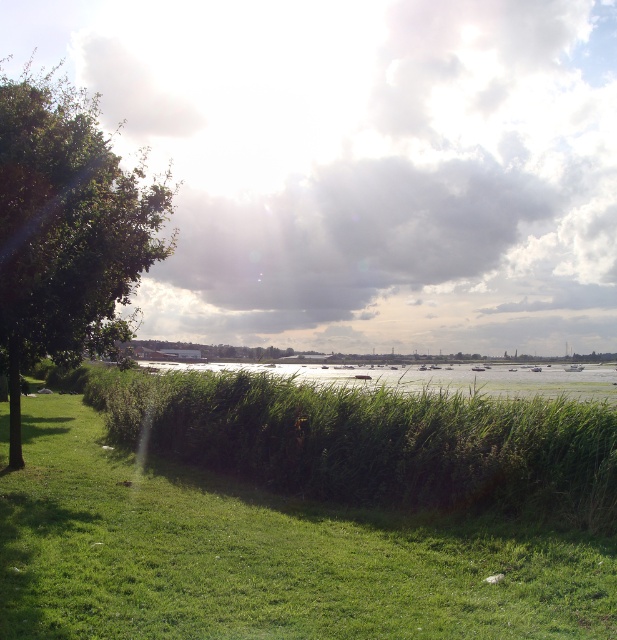
Question: Can you confirm if green grassy hedge at center is bigger than green grassy water at center?

Choices:
 (A) yes
 (B) no

Answer: (B)

Question: Which point is farther to the camera?

Choices:
 (A) green grassy hedge at center
 (B) green leafy tree at left

Answer: (B)

Question: Is green grassy hedge at center above green leafy tree at left?

Choices:
 (A) no
 (B) yes

Answer: (A)

Question: Which of the following is the farthest from the observer?

Choices:
 (A) green leafy tree at left
 (B) green grassy hedge at center
 (C) green grassy water at center

Answer: (C)

Question: Considering the relative positions of green grassy hedge at center and green grassy water at center in the image provided, where is green grassy hedge at center located with respect to green grassy water at center?

Choices:
 (A) right
 (B) left

Answer: (B)

Question: Which object appears farthest from the camera in this image?

Choices:
 (A) green grassy hedge at center
 (B) green grassy water at center

Answer: (B)